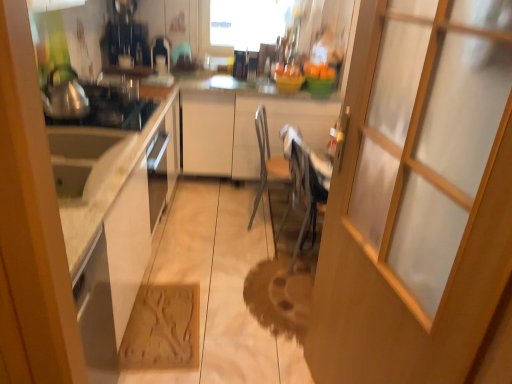
Question: Does brown textured mat at lower center have a lesser height compared to brushed metal tea pot at left?

Choices:
 (A) yes
 (B) no

Answer: (A)

Question: From a real-world perspective, does brown textured mat at lower center stand above brushed metal tea pot at left?

Choices:
 (A) yes
 (B) no

Answer: (B)

Question: From the image's perspective, would you say brown textured mat at lower center is positioned over brushed metal tea pot at left?

Choices:
 (A) no
 (B) yes

Answer: (A)

Question: From a real-world perspective, is brown textured mat at lower center located beneath brushed metal tea pot at left?

Choices:
 (A) yes
 (B) no

Answer: (A)

Question: Considering the relative sizes of brown textured mat at lower center and brushed metal tea pot at left in the image provided, is brown textured mat at lower center thinner than brushed metal tea pot at left?

Choices:
 (A) yes
 (B) no

Answer: (B)

Question: In the image, is transparent glass door at center positioned in front of or behind brown textured mat at lower center?

Choices:
 (A) front
 (B) behind

Answer: (A)

Question: Would you say transparent glass door at center is to the left or to the right of brown textured mat at lower center in the picture?

Choices:
 (A) right
 (B) left

Answer: (A)

Question: Is transparent glass door at center wider or thinner than brown textured mat at lower center?

Choices:
 (A) thin
 (B) wide

Answer: (A)

Question: Is transparent glass door at center spatially inside brown textured mat at lower center, or outside of it?

Choices:
 (A) inside
 (B) outside

Answer: (B)

Question: Is transparent glass window at upper center taller or shorter than transparent glass door at center?

Choices:
 (A) short
 (B) tall

Answer: (A)

Question: Is point (214, 44) closer or farther from the camera than point (448, 170)?

Choices:
 (A) closer
 (B) farther

Answer: (B)

Question: From the image's perspective, is transparent glass window at upper center located above or below transparent glass door at center?

Choices:
 (A) above
 (B) below

Answer: (A)

Question: Considering their positions, is transparent glass window at upper center located in front of or behind transparent glass door at center?

Choices:
 (A) behind
 (B) front

Answer: (A)

Question: In terms of height, does transparent glass door at center look taller or shorter compared to brushed metal tea pot at left?

Choices:
 (A) tall
 (B) short

Answer: (A)

Question: Considering the positions of transparent glass door at center and brushed metal tea pot at left in the image, is transparent glass door at center wider or thinner than brushed metal tea pot at left?

Choices:
 (A) thin
 (B) wide

Answer: (A)